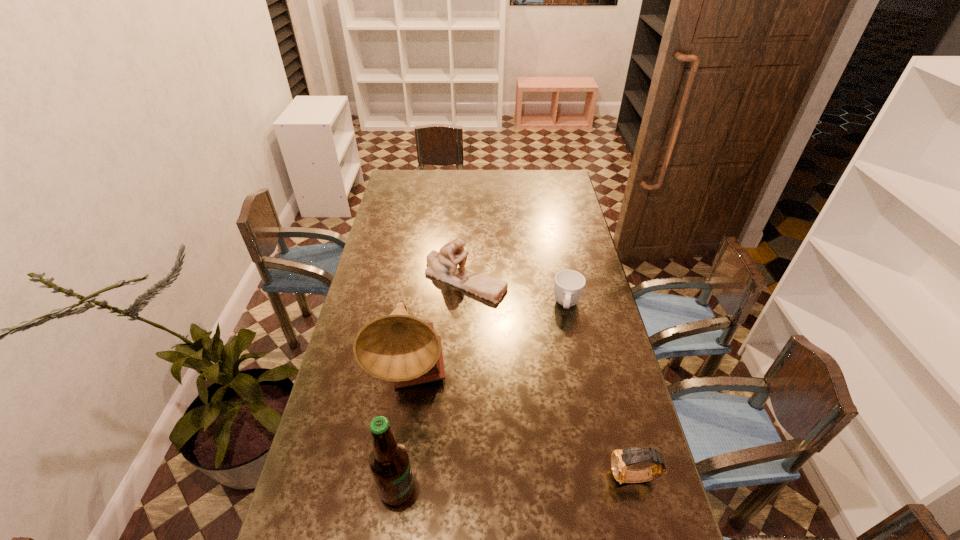
Identify the location of watch present at the right edge. Image resolution: width=960 pixels, height=540 pixels. (620, 459).

Find the location of `cup positioned at the right edge`. cup positioned at the right edge is located at coordinates (569, 284).

Find the location of a particular element. The width and height of the screenshot is (960, 540). vacant space at the far edge of the desktop is located at coordinates (512, 187).

Locate an element on the screen. The image size is (960, 540). free space at the near edge is located at coordinates (438, 537).

I want to click on vacant space at the left edge of the desktop, so click(x=381, y=240).

This screenshot has height=540, width=960. I want to click on free spot at the right edge of the desktop, so click(610, 328).

Find the location of a particular element. The width and height of the screenshot is (960, 540). free space at the near left corner of the desktop is located at coordinates (318, 519).

Where is `free point between the second tallest object and the watch`? The height and width of the screenshot is (540, 960). free point between the second tallest object and the watch is located at coordinates (516, 483).

The image size is (960, 540). I want to click on free area in between the third tallest object and the phonograph record, so click(439, 328).

Where is `free space between the third shortest object and the beer bottle`? This screenshot has height=540, width=960. free space between the third shortest object and the beer bottle is located at coordinates (431, 384).